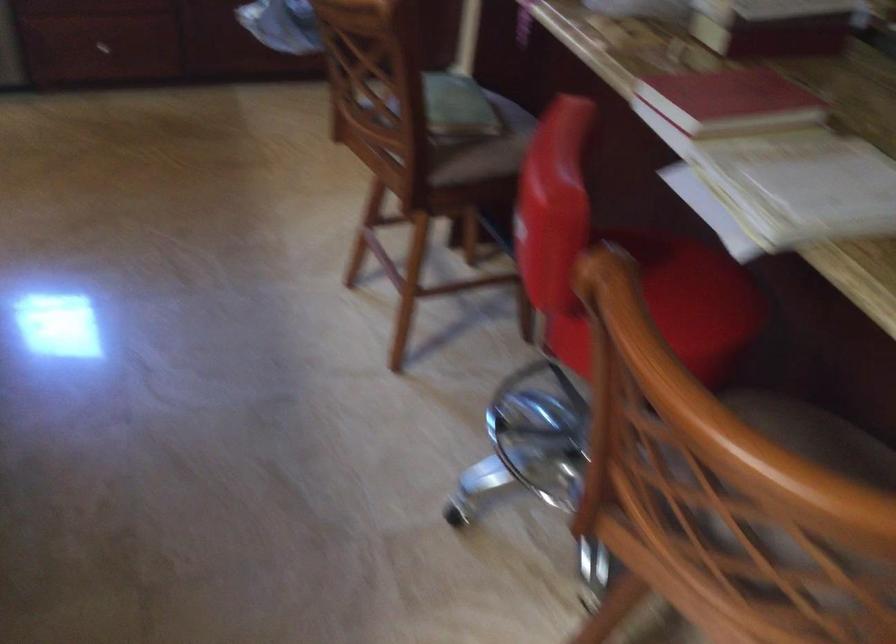
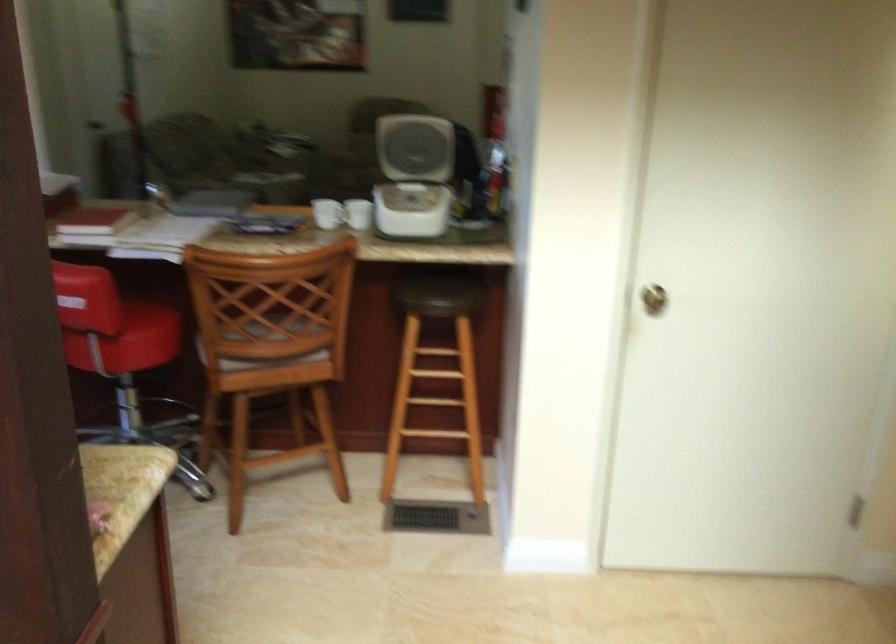
Where in the second image is the point corresponding to pixel 698 564 from the first image?

(271, 341)